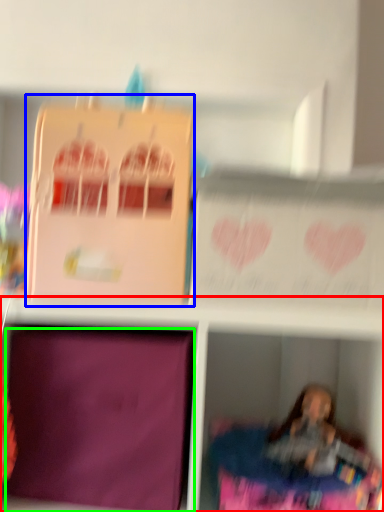
Question: Which is farther away from shelf (highlighted by a red box)? cardboard box (highlighted by a blue box) or cardboard box (highlighted by a green box)?

Choices:
 (A) cardboard box
 (B) cardboard box

Answer: (A)